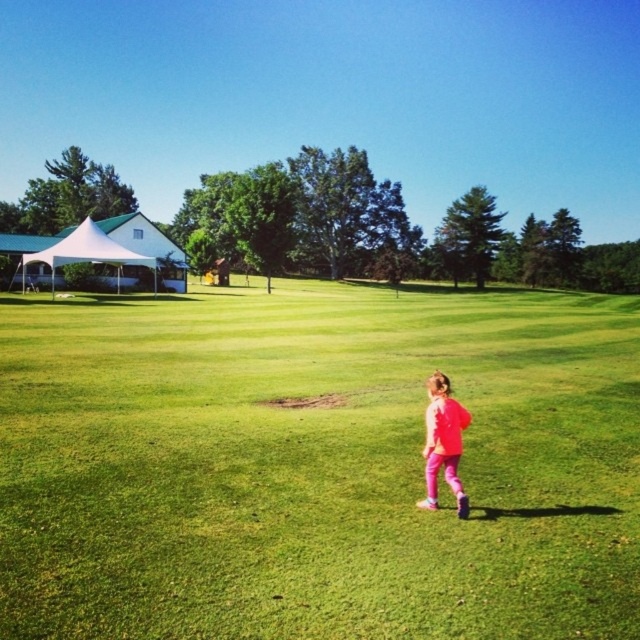
From the picture: Between white fabric tent at left and pink matte pants at center, which one appears on the right side from the viewer's perspective?

Positioned to the right is pink matte pants at center.

Does white fabric tent at left have a smaller size compared to pink matte pants at center?

Actually, white fabric tent at left might be larger than pink matte pants at center.

Locate an element on the screen. This screenshot has height=640, width=640. white fabric tent at left is located at coordinates (100, 256).

In the scene shown: Who is lower down, green grass at center or white fabric tent at left?

green grass at center is lower down.

Is green grass at center bigger than white fabric tent at left?

No.

The image size is (640, 640). Find the location of `green grass at center`. green grass at center is located at coordinates (317, 465).

Is green grass at center to the right of pink matte pants at center from the viewer's perspective?

Indeed, green grass at center is positioned on the right side of pink matte pants at center.

Is the position of green grass at center less distant than that of pink matte pants at center?

That is True.

Locate an element on the screen. green grass at center is located at coordinates (317, 465).